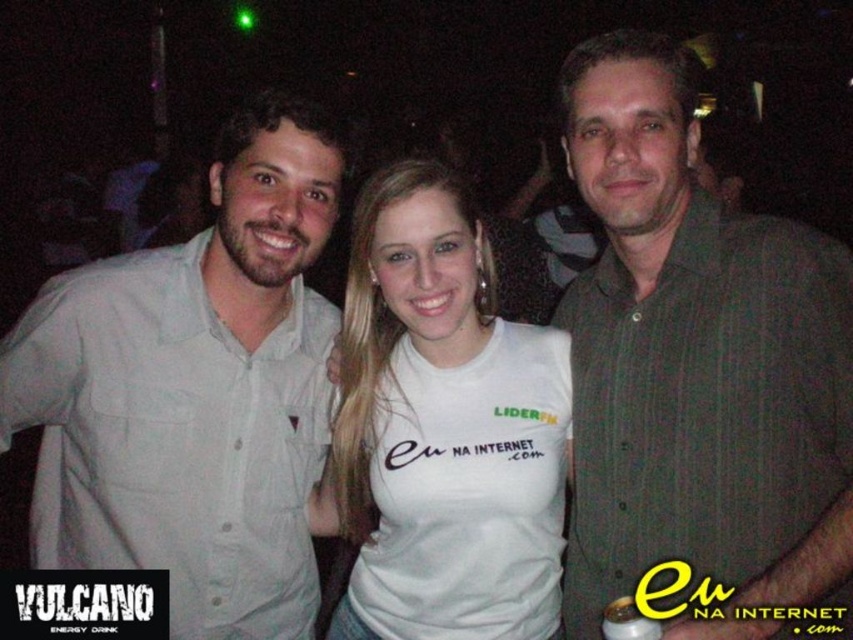
Question: Which point is farther to the camera?

Choices:
 (A) (450, 516)
 (B) (602, 52)
 (C) (146, 410)

Answer: (A)

Question: Which point is closer to the camera?

Choices:
 (A) dark green striped shirt at center
 (B) light gray button-up shirt at left
 (C) white cotton t-shirt at center

Answer: (A)

Question: Observing the image, what is the correct spatial positioning of light gray button-up shirt at left in reference to white cotton t-shirt at center?

Choices:
 (A) left
 (B) right

Answer: (A)

Question: Is dark green striped shirt at center to the right of light gray button-up shirt at left from the viewer's perspective?

Choices:
 (A) no
 (B) yes

Answer: (B)

Question: Estimate the real-world distances between objects in this image. Which object is closer to the dark green striped shirt at center?

Choices:
 (A) white cotton t-shirt at center
 (B) light gray button-up shirt at left

Answer: (A)

Question: Is dark green striped shirt at center bigger than light gray button-up shirt at left?

Choices:
 (A) yes
 (B) no

Answer: (A)